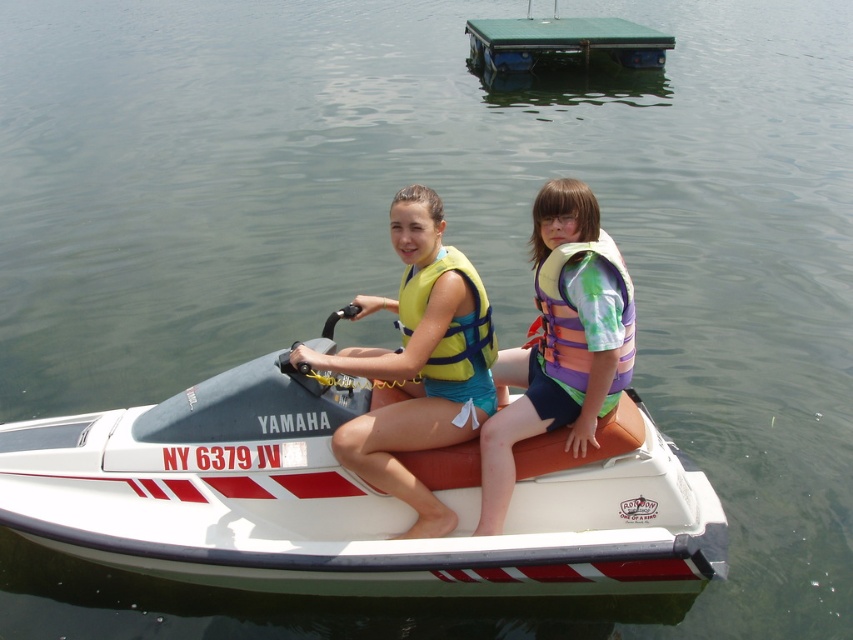
Question: Can you confirm if multicolored life vest at center is positioned above yellow fabric life jacket at center?

Choices:
 (A) no
 (B) yes

Answer: (A)

Question: Which object is closer to the camera taking this photo?

Choices:
 (A) white matte jet ski at center
 (B) yellow fabric life jacket at center
 (C) multicolored life vest at center

Answer: (A)

Question: Which point is farther to the camera?

Choices:
 (A) [x=421, y=296]
 (B) [x=409, y=378]
 (C) [x=238, y=412]
 (D) [x=575, y=310]

Answer: (C)

Question: Is multicolored life vest at center below multicolored fabric life jacket at center?

Choices:
 (A) no
 (B) yes

Answer: (B)

Question: Which object appears closest to the camera in this image?

Choices:
 (A) multicolored life vest at center
 (B) multicolored fabric life jacket at center
 (C) yellow fabric life jacket at center

Answer: (A)

Question: Can you confirm if white matte jet ski at center is positioned to the left of multicolored life vest at center?

Choices:
 (A) no
 (B) yes

Answer: (B)